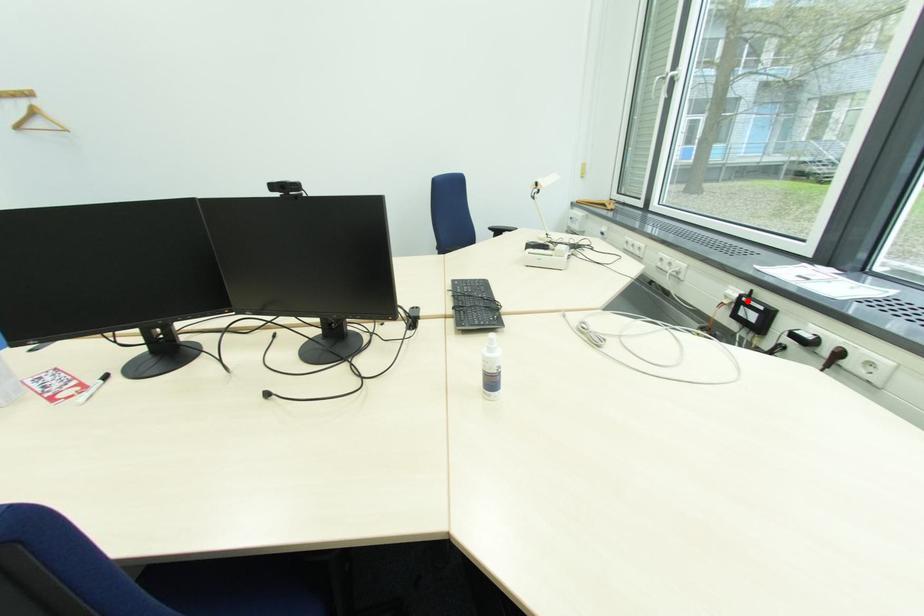
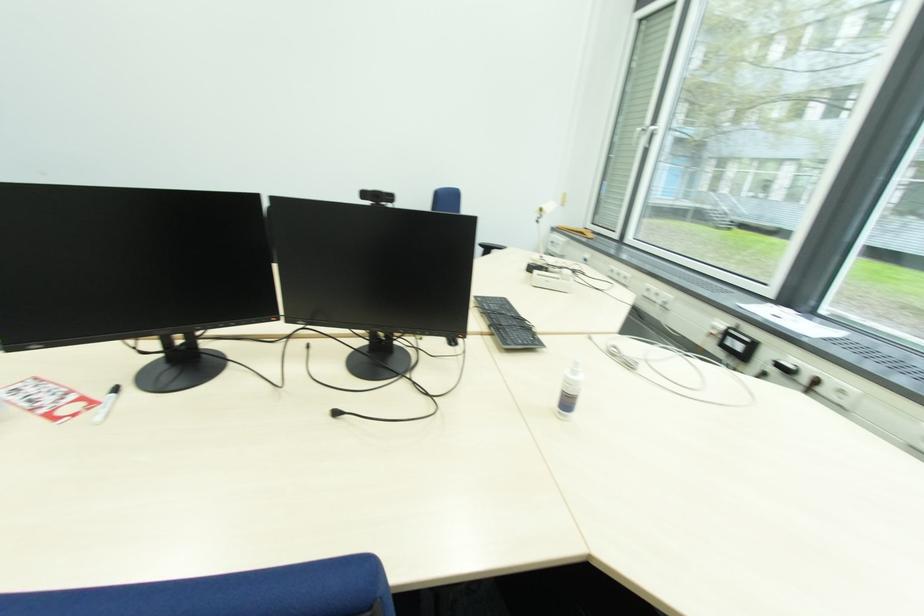
Where in the second image is the point corresponding to the highlighted location from the first image?

(734, 333)